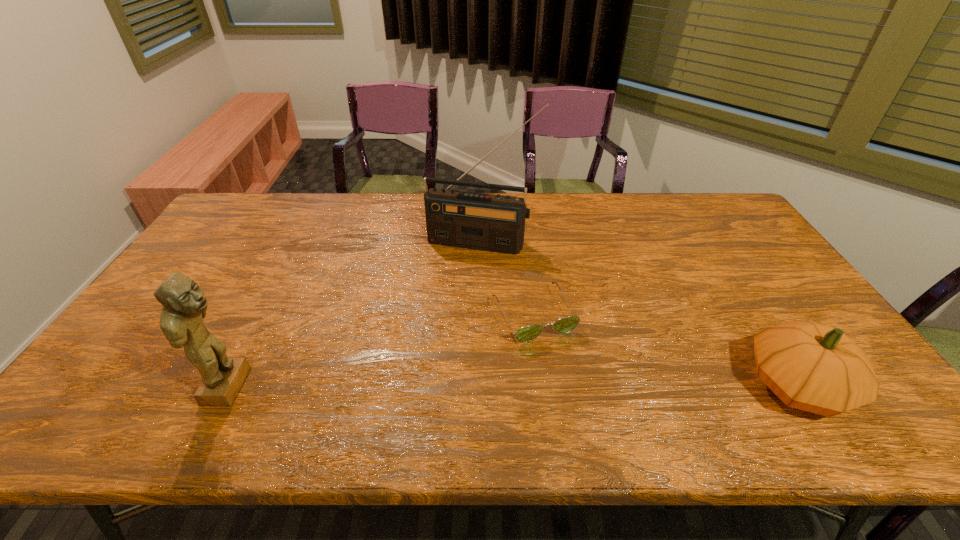
Where is `vacant space located on the front-facing side of the radio receiver`? This screenshot has height=540, width=960. vacant space located on the front-facing side of the radio receiver is located at coordinates [x=462, y=274].

At what (x,y) coordinates should I click in order to perform the action: click on free space located 0.160m on the front-facing side of the radio receiver. Please return your answer as a coordinate pair (x, y). Looking at the image, I should click on (x=457, y=287).

This screenshot has height=540, width=960. Identify the location of vacant space located 0.220m on the front-facing side of the radio receiver. (x=452, y=301).

This screenshot has width=960, height=540. I want to click on free region located 0.090m on the front-facing side of the sunglasses, so click(565, 372).

Where is `vacant area located on the front-facing side of the sunglasses`? vacant area located on the front-facing side of the sunglasses is located at coordinates (564, 368).

The height and width of the screenshot is (540, 960). What are the coordinates of `figurine that is at the near edge` in the screenshot? It's located at (184, 305).

Image resolution: width=960 pixels, height=540 pixels. What are the coordinates of `gourd present at the near edge` in the screenshot? It's located at [x=817, y=368].

The width and height of the screenshot is (960, 540). I want to click on object situated at the right edge, so click(817, 368).

You are a GUI agent. You are given a task and a screenshot of the screen. Output one action in this format:
    pyautogui.click(x=<x>, y=<y>)
    Task: Click on the object that is positioned at the near right corner
    
    Given the screenshot: What is the action you would take?
    pyautogui.click(x=817, y=368)

In the image, there is a desktop. Where is `vacant space at the far edge`? vacant space at the far edge is located at coordinates (584, 221).